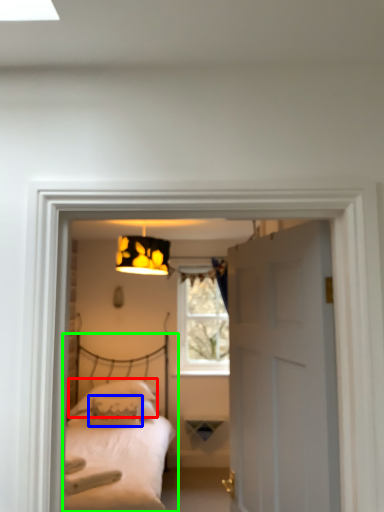
Question: Which is farther away from pillow (highlighted by a red box)? pillow (highlighted by a blue box) or bed (highlighted by a green box)?

Choices:
 (A) pillow
 (B) bed

Answer: (B)